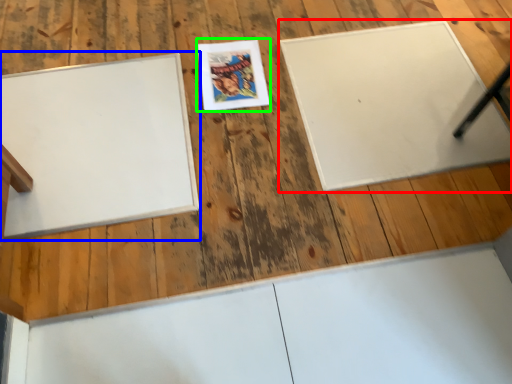
Question: Which object is positioned closest to bulletin board (highlighted by a red box)? Select from bulletin board (highlighted by a blue box) and comic book (highlighted by a green box).

Choices:
 (A) bulletin board
 (B) comic book

Answer: (B)